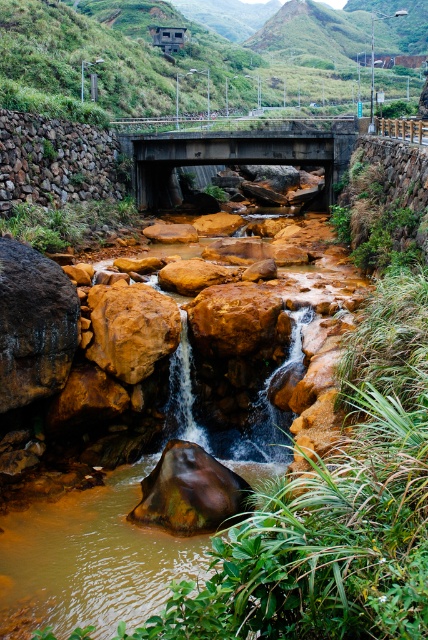
Question: Is concrete bridge at upper center in front of rustic stone wall at left?

Choices:
 (A) no
 (B) yes

Answer: (A)

Question: Is the position of concrete bridge at upper center less distant than that of rustic stone wall at left?

Choices:
 (A) no
 (B) yes

Answer: (A)

Question: In this image, where is concrete bridge at upper center located relative to rustic stone wall at left?

Choices:
 (A) below
 (B) above

Answer: (B)

Question: Which of the following is the farthest from the observer?

Choices:
 (A) concrete bridge at upper center
 (B) rustic stone wall at left

Answer: (A)